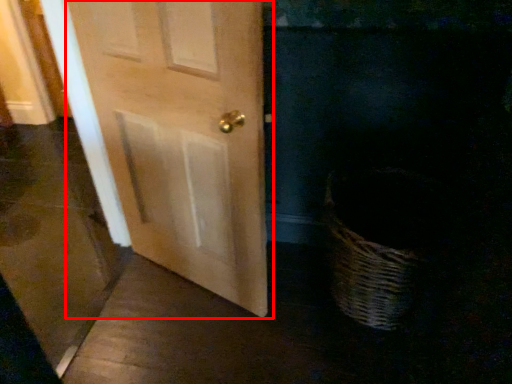
Question: From the image's perspective, what is the correct spatial positioning of door (annotated by the red box) in reference to screen door?

Choices:
 (A) below
 (B) above

Answer: (B)